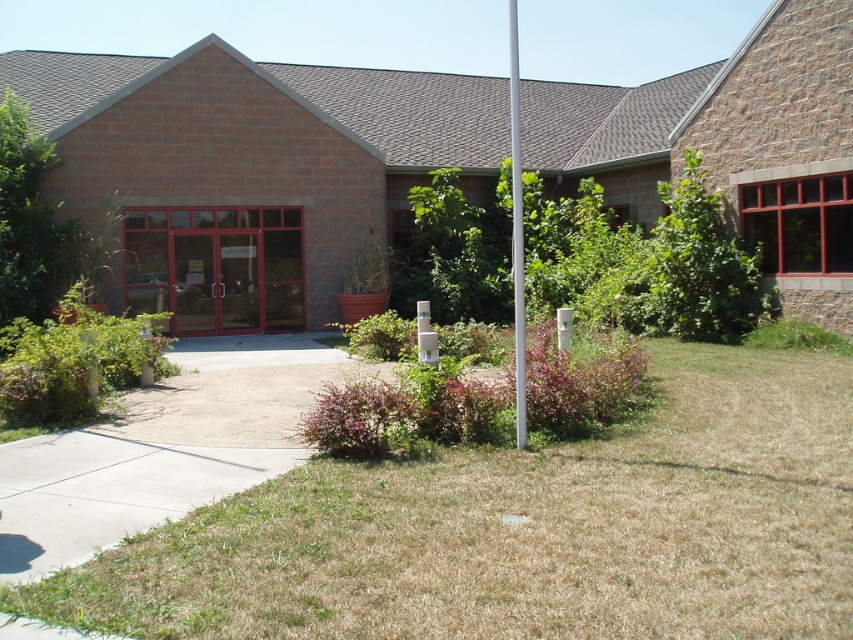
Question: Which object appears farthest from the camera in this image?

Choices:
 (A) brown grass at lower center
 (B) white metallic pole at center

Answer: (B)

Question: Can you confirm if brown grass at lower center is bigger than white metallic pole at center?

Choices:
 (A) no
 (B) yes

Answer: (A)

Question: Is brown grass at lower center positioned at the back of white metallic pole at center?

Choices:
 (A) no
 (B) yes

Answer: (A)

Question: Which object is farther from the camera taking this photo?

Choices:
 (A) brown grass at lower center
 (B) white metallic pole at center

Answer: (B)

Question: Does brown grass at lower center appear on the right side of white metallic pole at center?

Choices:
 (A) no
 (B) yes

Answer: (A)

Question: Among these objects, which one is farthest from the camera?

Choices:
 (A) white metallic pole at center
 (B) brown grass at lower center

Answer: (A)